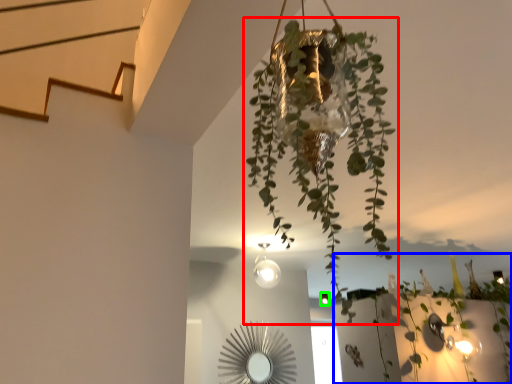
Question: Which object is positioned closest to houseplant (highlighted by a red box)? Select from plant (highlighted by a blue box) and light fixture (highlighted by a green box).

Choices:
 (A) plant
 (B) light fixture

Answer: (A)